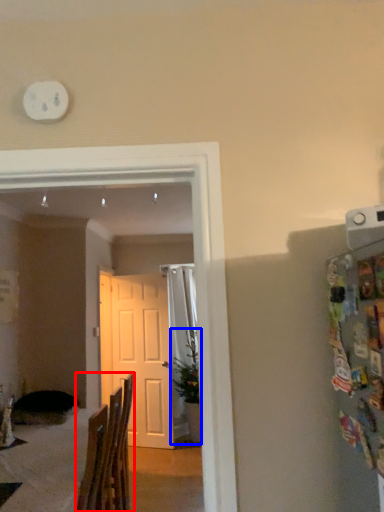
Question: Which object is further to the camera taking this photo, chair (highlighted by a red box) or houseplant (highlighted by a blue box)?

Choices:
 (A) chair
 (B) houseplant

Answer: (B)